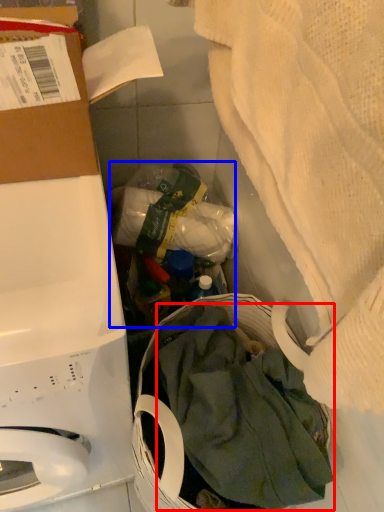
Question: Which object appears farthest to the camera in this image, clothing (highlighted by a red box) or garbage (highlighted by a blue box)?

Choices:
 (A) clothing
 (B) garbage

Answer: (B)